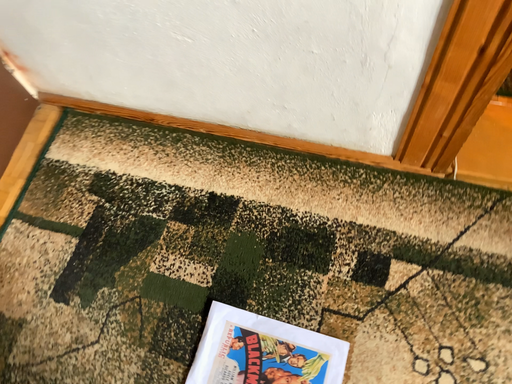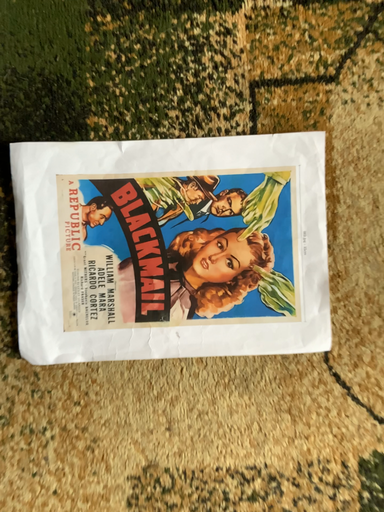
Question: Which way did the camera rotate in the video?

Choices:
 (A) rotated upward
 (B) rotated downward

Answer: (B)